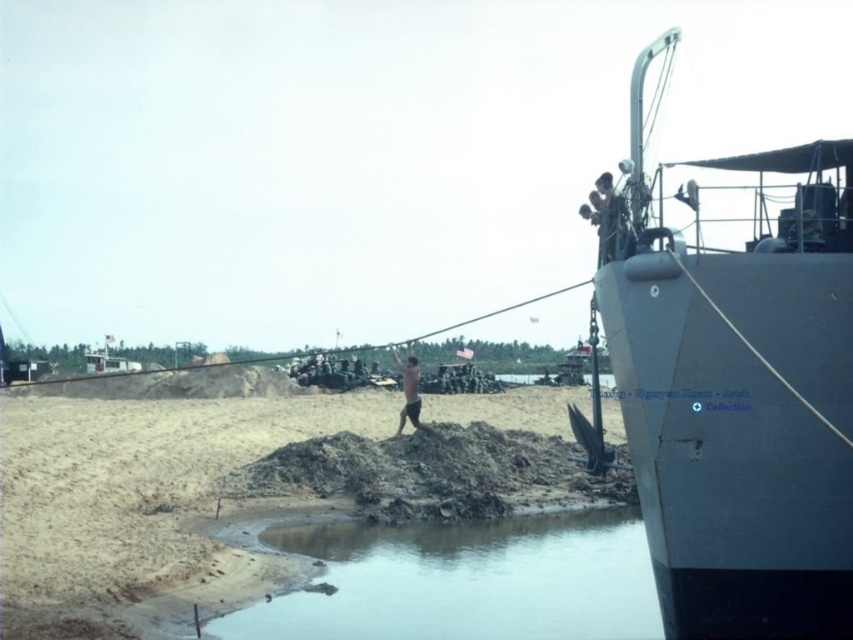
Based on the photo, between brown sandy dirt at center and smooth skin person at upper right, which one has more height?

Standing taller between the two is smooth skin person at upper right.

Is point (44, 552) positioned before point (621, 204)?

No, (44, 552) is further to viewer.

At what (x,y) coordinates should I click in order to perform the action: click on brown sandy dirt at center. Please return your answer as a coordinate pair (x, y). This screenshot has width=853, height=640. Looking at the image, I should click on pyautogui.click(x=142, y=496).

Can you confirm if muddy water at lower left is shorter than skinny man at center?

Correct, muddy water at lower left is not as tall as skinny man at center.

Does muddy water at lower left appear over skinny man at center?

No, muddy water at lower left is not above skinny man at center.

Which is behind, point (471, 589) or point (410, 358)?

Point (410, 358)

Locate an element on the screen. The image size is (853, 640). muddy water at lower left is located at coordinates (463, 580).

Consider the image. Is dark gray metal boat at upper right closer to camera compared to brown sandy dirt at center?

Yes, it is in front of brown sandy dirt at center.

Does point (759, 621) lie behind point (560, 394)?

No, (759, 621) is in front of (560, 394).

Who is more forward, (798, 216) or (51, 486)?

Point (798, 216) is more forward.

You are a GUI agent. You are given a task and a screenshot of the screen. Output one action in this format:
    pyautogui.click(x=<x>, y=<y>)
    Task: Click on the dark gray metal boat at upper right
    
    Given the screenshot: What is the action you would take?
    pyautogui.click(x=740, y=396)